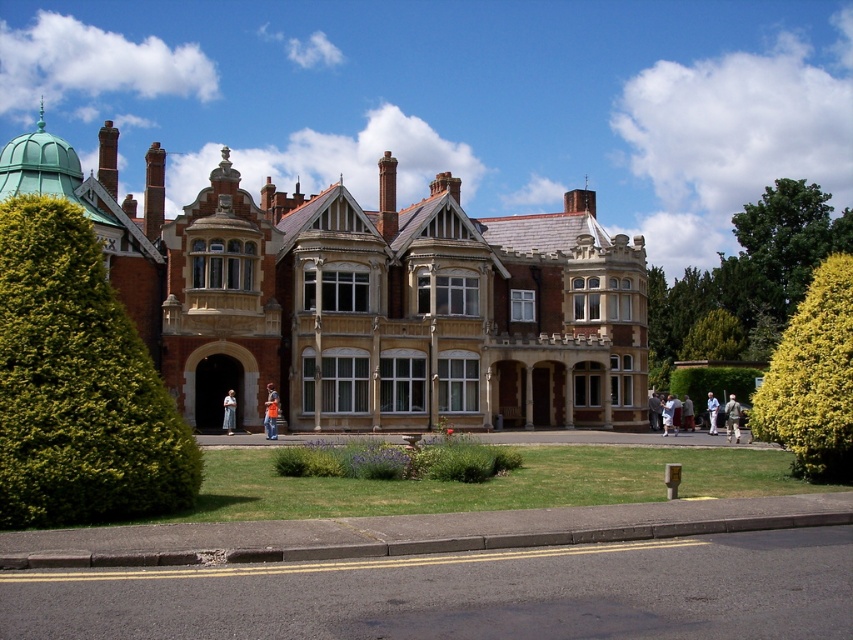
You are standing in front of the Victorian building and see a person wearing an orange fabric shirt at center and a light brown leather jacket at lower right. Which clothing item is located to the left of the other?

The orange fabric shirt at center is positioned on the left side of light brown leather jacket at lower right.